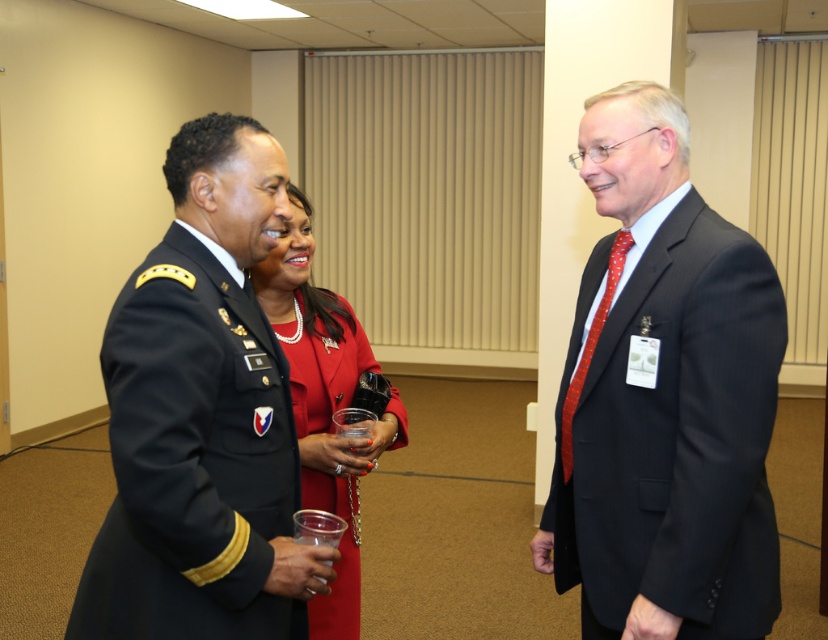
Can you confirm if shiny red coat at center is bigger than transparent plastic cup at center?

Yes, shiny red coat at center is bigger than transparent plastic cup at center.

Can you confirm if shiny red coat at center is positioned to the right of transparent plastic cup at center?

Incorrect, shiny red coat at center is not on the right side of transparent plastic cup at center.

Where is `shiny red coat at center`? shiny red coat at center is located at coordinates (323, 401).

Identify the location of shiny red coat at center. This screenshot has height=640, width=828. (323, 401).

Who is positioned more to the left, shiny black uniform at center or shiny red coat at center?

shiny black uniform at center

Between shiny black uniform at center and shiny red coat at center, which one is positioned higher?

Positioned higher is shiny black uniform at center.

The image size is (828, 640). Describe the element at coordinates (201, 417) in the screenshot. I see `shiny black uniform at center` at that location.

Locate an element on the screen. This screenshot has width=828, height=640. shiny black uniform at center is located at coordinates (201, 417).

Is the position of matte black suit at right less distant than that of transparent plastic cup at center?

That is True.

Can you confirm if matte black suit at right is shorter than transparent plastic cup at center?

No, matte black suit at right is not shorter than transparent plastic cup at center.

This screenshot has width=828, height=640. What do you see at coordinates (663, 396) in the screenshot?
I see `matte black suit at right` at bounding box center [663, 396].

Locate an element on the screen. The width and height of the screenshot is (828, 640). matte black suit at right is located at coordinates (663, 396).